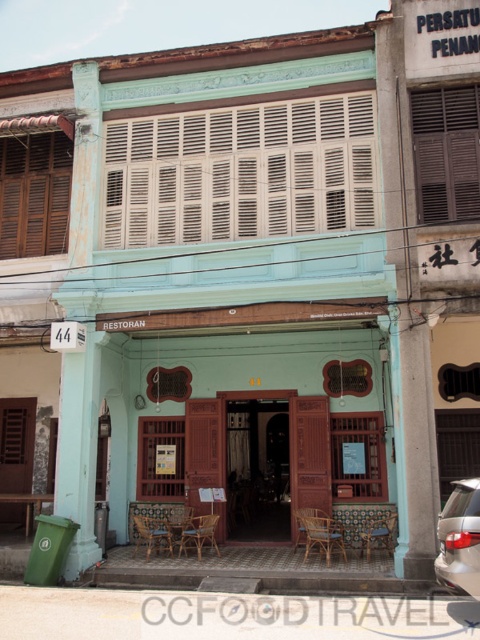
Question: Which point appears farthest from the camera in this image?

Choices:
 (A) (339, 541)
 (B) (326, 515)
 (C) (383, 525)
 (D) (203, 528)

Answer: (B)

Question: Can you confirm if wooden chair at lower center is wider than brown woven chair at center?

Choices:
 (A) yes
 (B) no

Answer: (A)

Question: Which of the following is the farthest from the observer?

Choices:
 (A) (147, 561)
 (B) (316, 520)
 (C) (456, 520)
 (D) (364, 550)

Answer: (D)

Question: Is the position of satin silver car at lower right more distant than that of wooden chair at center?

Choices:
 (A) no
 (B) yes

Answer: (A)

Question: Can you confirm if wooden chair at center is wider than wooden chair at lower center?

Choices:
 (A) no
 (B) yes

Answer: (A)

Question: Based on their relative distances, which object is farther from the rattan chair at center?

Choices:
 (A) woven rattan chair at center
 (B) wooden chair at lower center
 (C) brown woven chair at center
 (D) wooden chair at center

Answer: (B)